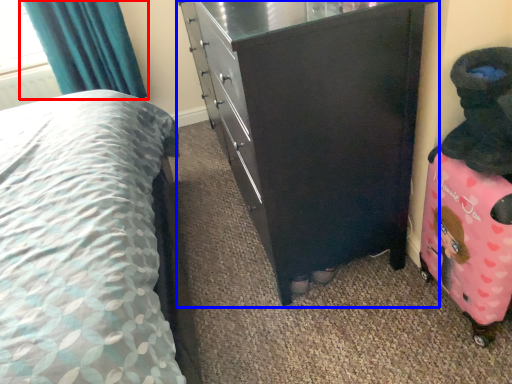
Question: Which object is closer to the camera taking this photo, curtain (highlighted by a red box) or chest of drawers (highlighted by a blue box)?

Choices:
 (A) curtain
 (B) chest of drawers

Answer: (B)